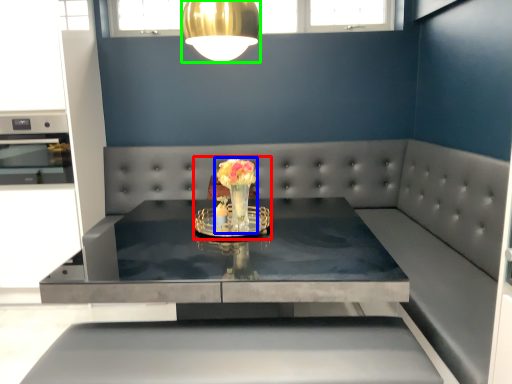
Question: Estimate the real-world distances between objects in this image. Which object is farther from floral arrangement (highlighted by a red box), floral arrangement (highlighted by a blue box) or lamp (highlighted by a green box)?

Choices:
 (A) floral arrangement
 (B) lamp

Answer: (B)